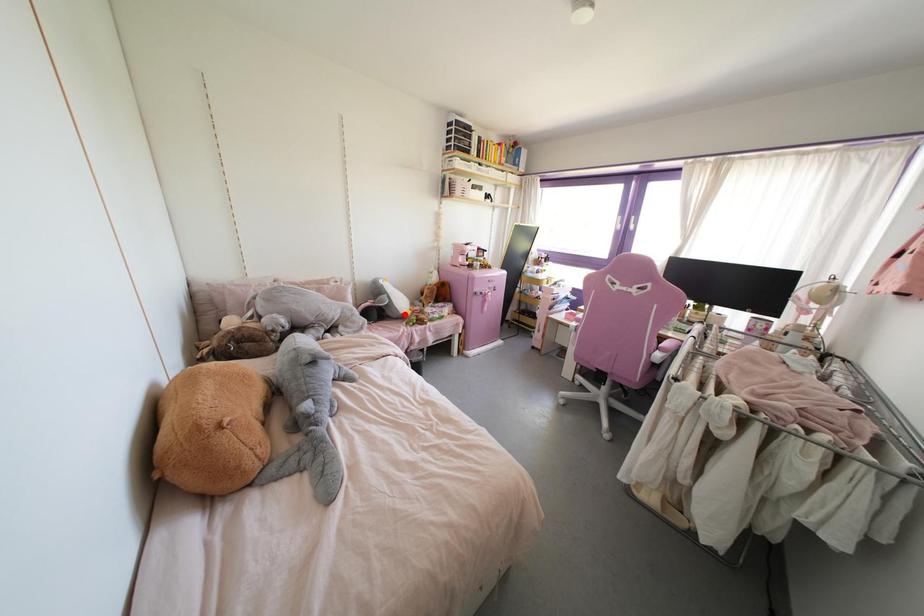
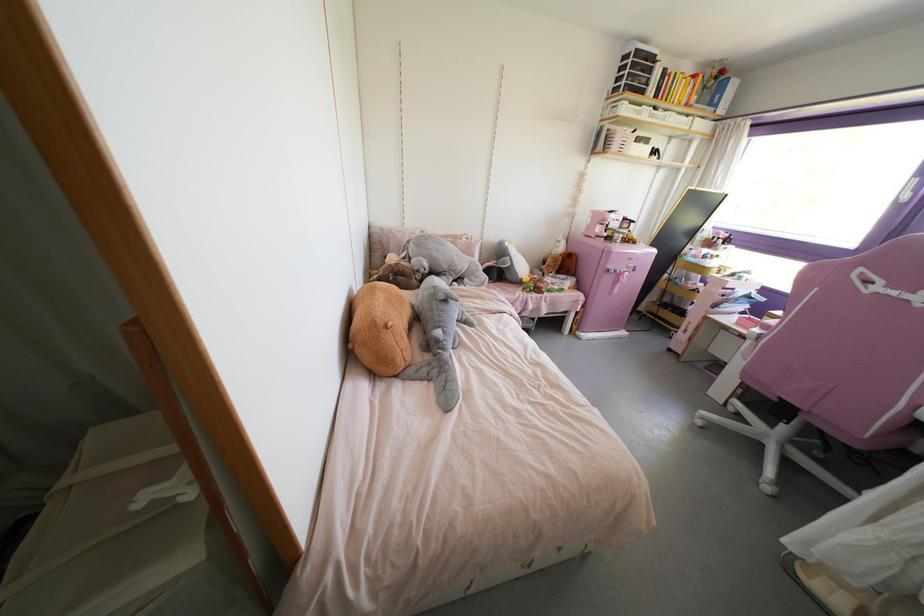
Where in the second image is the point corresponding to the highlighted location from the first image?

(523, 280)